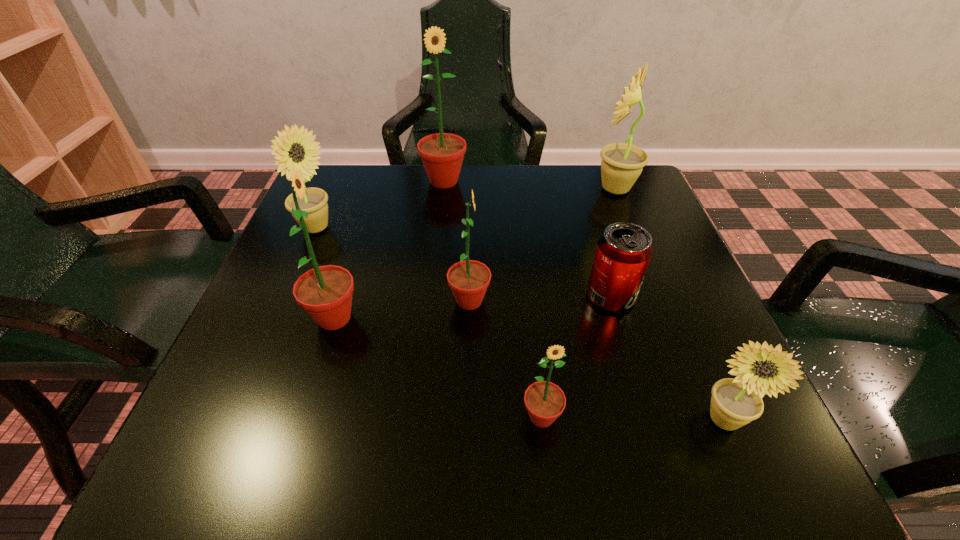
At what (x,y) coordinates should I click in order to perform the action: click on the biggest green sunflower. Please return your answer as a coordinate pair (x, y). Looking at the image, I should click on (442, 154).

Image resolution: width=960 pixels, height=540 pixels. Find the location of `the farthest green sunflower`. the farthest green sunflower is located at coordinates click(442, 154).

Where is `the biggest yellow sunflower`? The width and height of the screenshot is (960, 540). the biggest yellow sunflower is located at coordinates (621, 165).

Where is `the leftmost green sunflower`? the leftmost green sunflower is located at coordinates (325, 293).

Identify the location of the sixth sunflower from right to left. (325, 293).

Image resolution: width=960 pixels, height=540 pixels. Identify the location of the leftmost object. (289, 152).

Locate an element on the screen. The image size is (960, 540). the third farthest sunflower is located at coordinates (289, 152).

Locate an element on the screen. the third biggest green sunflower is located at coordinates (469, 279).

Where is `the smallest yellow sunflower`? This screenshot has height=540, width=960. the smallest yellow sunflower is located at coordinates (735, 402).

Locate an element on the screen. the nearest green sunflower is located at coordinates (545, 401).